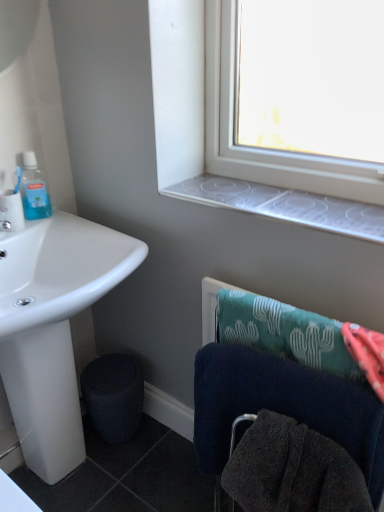
Question: Considering the positions of point (344, 415) and point (52, 366), is point (344, 415) closer or farther from the camera than point (52, 366)?

Choices:
 (A) closer
 (B) farther

Answer: (A)

Question: From the image's perspective, is dark blue towel at lower right located above or below white glossy sink at lower left?

Choices:
 (A) below
 (B) above

Answer: (A)

Question: Which object is the closest to the clear plastic window sill at upper center?

Choices:
 (A) dark blue towel at lower right
 (B) matte white toothbrush at left
 (C) black matte trash bin/can at lower left
 (D) translucent plastic mouthwash at upper left
 (E) white glossy sink at lower left

Answer: (A)

Question: Which object is the closest to the white glossy sink at lower left?

Choices:
 (A) matte white toothbrush at left
 (B) black matte trash bin/can at lower left
 (C) translucent plastic mouthwash at upper left
 (D) clear plastic window sill at upper center
 (E) dark blue towel at lower right

Answer: (B)